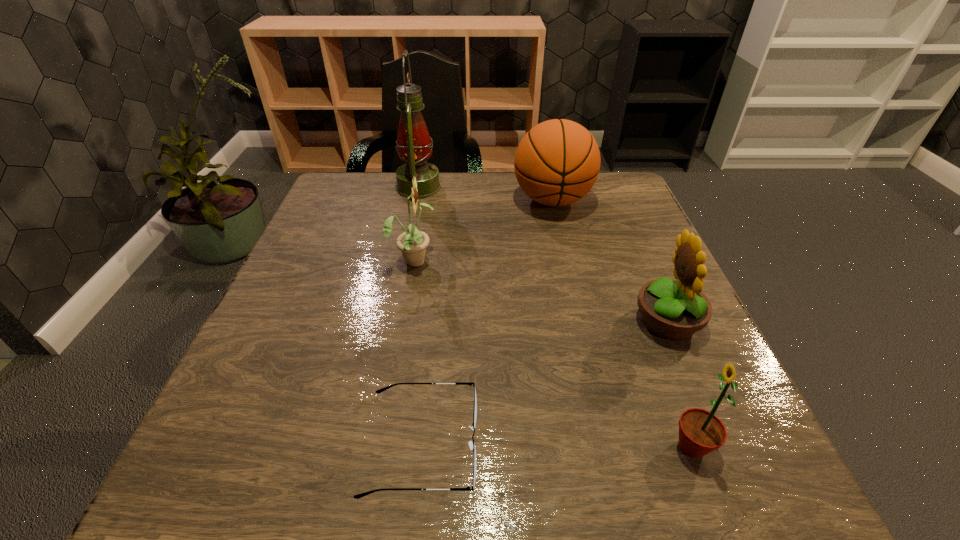
The width and height of the screenshot is (960, 540). What are the coordinates of `spectacles that is at the near edge` in the screenshot? It's located at (472, 445).

This screenshot has width=960, height=540. Find the location of `basketball at the right edge`. basketball at the right edge is located at coordinates (557, 162).

The image size is (960, 540). What are the coordinates of `object located at the far right corner` in the screenshot? It's located at (557, 162).

This screenshot has width=960, height=540. Find the location of `object present at the near right corner`. object present at the near right corner is located at coordinates (700, 432).

In the image, there is a desktop. Where is `free space at the far edge`? Image resolution: width=960 pixels, height=540 pixels. free space at the far edge is located at coordinates (480, 174).

At what (x,y) coordinates should I click in order to perform the action: click on vacant space at the near edge of the desktop. Please return your answer as a coordinate pair (x, y). The image size is (960, 540). Looking at the image, I should click on 622,455.

You are a GUI agent. You are given a task and a screenshot of the screen. Output one action in this format:
    pyautogui.click(x=<x>, y=<y>)
    Task: Click on the vacant space at the left edge of the desktop
    The image size is (960, 540).
    Given the screenshot: What is the action you would take?
    pyautogui.click(x=354, y=257)

Find the location of a particular element. vacant space at the right edge of the desktop is located at coordinates (679, 364).

Locate an element on the screen. The height and width of the screenshot is (540, 960). vacant space at the far left corner of the desktop is located at coordinates (354, 194).

Where is `vacant space at the near left corner`? Image resolution: width=960 pixels, height=540 pixels. vacant space at the near left corner is located at coordinates (285, 447).